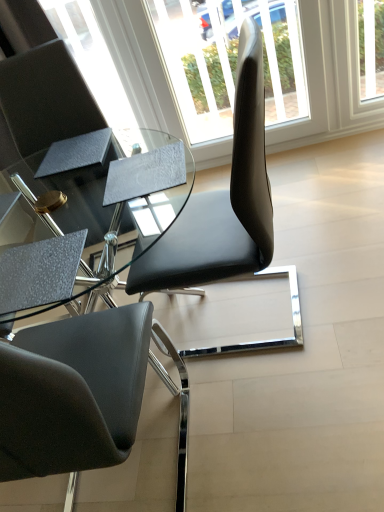
Describe the element at coordinates (229, 60) in the screenshot. I see `transparent glass window at center` at that location.

Identify the location of transparent glass window at center. This screenshot has width=384, height=512. (229, 60).

In order to click on matte black chair at upper left in this screenshot , I will do `click(56, 131)`.

What do you see at coordinates (56, 131) in the screenshot? I see `matte black chair at upper left` at bounding box center [56, 131].

This screenshot has height=512, width=384. I want to click on transparent glass window at center, so click(x=229, y=60).

Is transparent glass window at center to the right of matte black chair at upper left from the viewer's perspective?

Yes.

Is transparent glass window at center positioned behind matte black chair at upper left?

Yes, transparent glass window at center is further from the viewer.

Is point (223, 5) positioned in front of point (3, 81)?

That is False.

From the image's perspective, is transparent glass window at center over matte black chair at upper left?

Yes.

From a real-world perspective, which object stands above the other?

matte black chair at upper left.

Is transparent glass window at center thinner than matte black chair at upper left?

Yes.

In terms of height, does transparent glass window at center look taller or shorter compared to matte black chair at upper left?

Clearly, transparent glass window at center is taller compared to matte black chair at upper left.

Considering the relative sizes of transparent glass window at center and matte black chair at upper left in the image provided, is transparent glass window at center smaller than matte black chair at upper left?

Correct, transparent glass window at center occupies less space than matte black chair at upper left.

Choose the correct answer: Is transparent glass window at center inside matte black chair at upper left or outside it?

transparent glass window at center is outside matte black chair at upper left.

Is transparent glass window at center beside matte black chair at upper left?

They are not placed beside each other.

Is transparent glass window at center facing away from matte black chair at upper left?

No, transparent glass window at center is not facing away from matte black chair at upper left.

Where is `window above the matte black chair at upper left (from the image's perspective)`? This screenshot has width=384, height=512. window above the matte black chair at upper left (from the image's perspective) is located at coordinates (229, 60).

Considering the positions of objects matte black chair at upper left and transparent glass window at center in the image provided, who is more to the left, matte black chair at upper left or transparent glass window at center?

matte black chair at upper left is more to the left.

Is the depth of matte black chair at upper left greater than that of transparent glass window at center?

No, it is in front of transparent glass window at center.

Considering the points (18, 123) and (220, 63), which point is behind, point (18, 123) or point (220, 63)?

Point (220, 63)

From the image's perspective, is matte black chair at upper left on transparent glass window at center?

No, from the image's perspective, matte black chair at upper left is not over transparent glass window at center.

From a real-world perspective, which object stands above the other?

From a 3D spatial view, matte black chair at upper left is above.

Considering the relative sizes of matte black chair at upper left and transparent glass window at center in the image provided, is matte black chair at upper left wider than transparent glass window at center?

Correct, the width of matte black chair at upper left exceeds that of transparent glass window at center.

In terms of height, does matte black chair at upper left look taller or shorter compared to transparent glass window at center?

matte black chair at upper left is shorter than transparent glass window at center.

Considering the relative sizes of matte black chair at upper left and transparent glass window at center in the image provided, is matte black chair at upper left bigger than transparent glass window at center?

Yes, matte black chair at upper left is bigger than transparent glass window at center.

Choose the correct answer: Is matte black chair at upper left inside transparent glass window at center or outside it?

matte black chair at upper left cannot be found inside transparent glass window at center.

Is matte black chair at upper left touching transparent glass window at center?

matte black chair at upper left is not next to transparent glass window at center, and they're not touching.

Could you tell me if matte black chair at upper left is turned towards transparent glass window at center?

No, matte black chair at upper left is not facing towards transparent glass window at center.

What's the angular difference between matte black chair at upper left and transparent glass window at center's facing directions?

10.4 degrees separate the facing orientations of matte black chair at upper left and transparent glass window at center.

At what (x,y) coordinates should I click in order to perform the action: click on window behind the matte black chair at upper left. Please return your answer as a coordinate pair (x, y). Looking at the image, I should click on (229, 60).

Locate an element on the screen. The image size is (384, 512). chair that is above the transparent glass window at center (from a real-world perspective) is located at coordinates (56, 131).

This screenshot has height=512, width=384. Identify the location of window lying on the right of matte black chair at upper left. tap(229, 60).